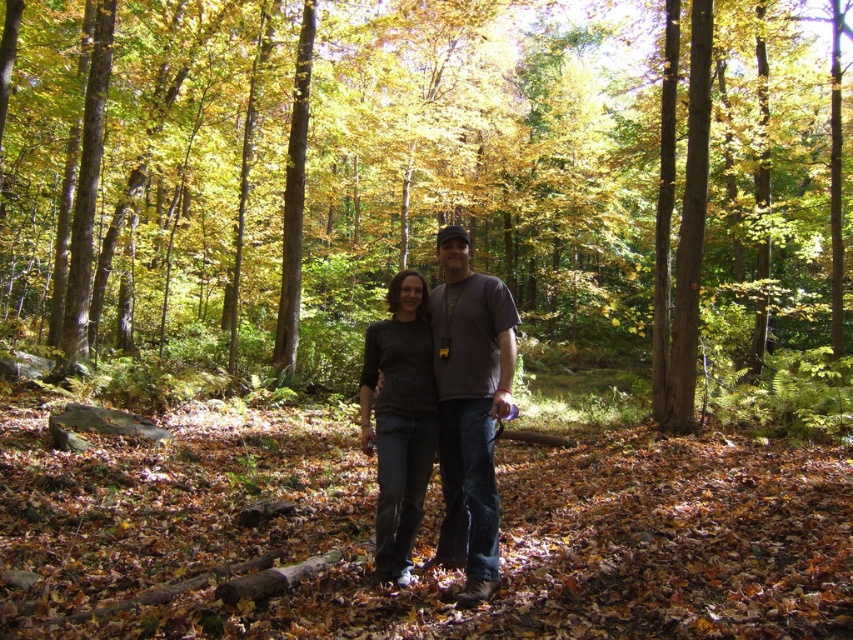
Question: Which of these objects is positioned closest to the knit sweater at center?

Choices:
 (A) dark gray sweater at center
 (B) brown wood tree at center

Answer: (A)

Question: Does brown wood tree at center appear under dark gray sweater at center?

Choices:
 (A) no
 (B) yes

Answer: (A)

Question: Can you confirm if brown wood tree at center is wider than knit sweater at center?

Choices:
 (A) no
 (B) yes

Answer: (B)

Question: Does dark gray sweater at center have a lesser width compared to knit sweater at center?

Choices:
 (A) no
 (B) yes

Answer: (B)

Question: Among these objects, which one is farthest from the camera?

Choices:
 (A) knit sweater at center
 (B) brown wood tree at center
 (C) dark gray sweater at center

Answer: (B)

Question: Based on their relative distances, which object is nearer to the knit sweater at center?

Choices:
 (A) brown wood tree at center
 (B) dark gray sweater at center

Answer: (B)